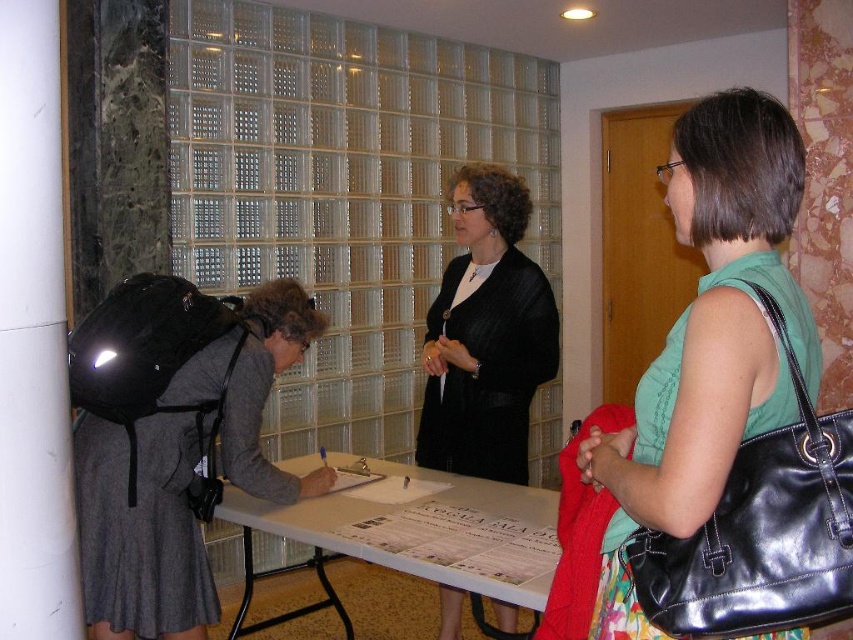
Question: Does green fabric shirt at right have a greater width compared to white smooth pillar at left?

Choices:
 (A) no
 (B) yes

Answer: (B)

Question: Which point is closer to the camera?

Choices:
 (A) pos(494,192)
 (B) pos(286,529)
 (C) pos(142,436)
 (D) pos(22,566)

Answer: (D)

Question: Where is green fabric shirt at right located in relation to white paper at center in the image?

Choices:
 (A) left
 (B) right

Answer: (B)

Question: Which point is farther from the camera taking this photo?

Choices:
 (A) (515, 179)
 (B) (57, 356)

Answer: (A)

Question: Is black textured blazer at center above white paper at center?

Choices:
 (A) yes
 (B) no

Answer: (A)

Question: Which point is closer to the camera taking this photo?

Choices:
 (A) (405, 561)
 (B) (4, 518)
 (C) (198, 333)
 (D) (746, 230)

Answer: (B)